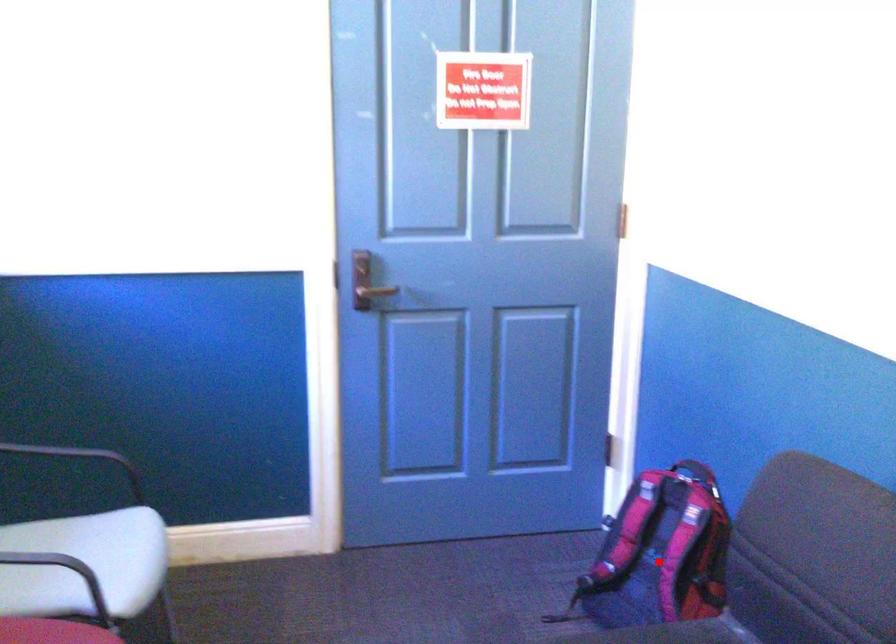
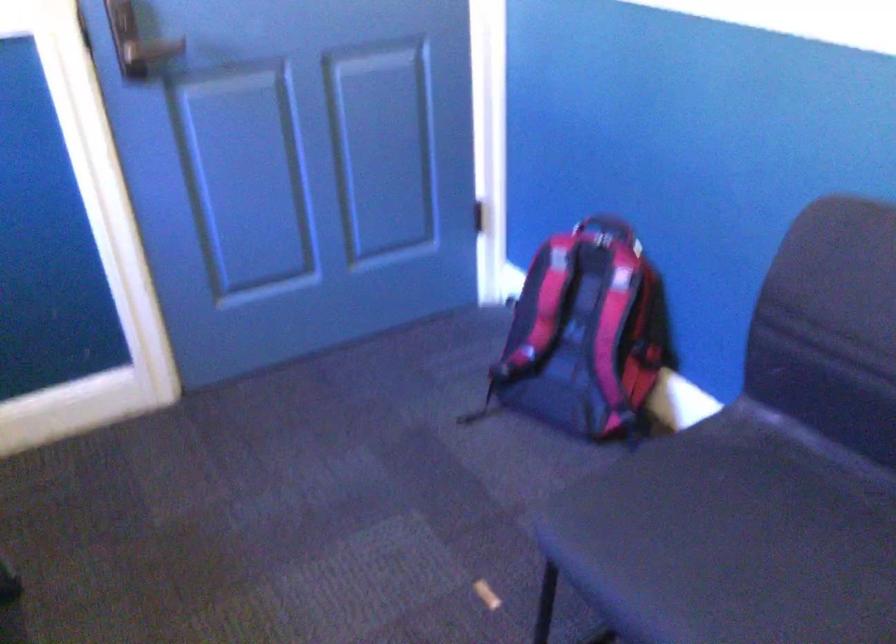
Question: I am providing you with two images of the same scene from different viewpoints. A red point is shown in image1. For the corresponding object point in image2, is it positioned nearer or farther from the camera?

Choices:
 (A) Nearer
 (B) Farther

Answer: (A)